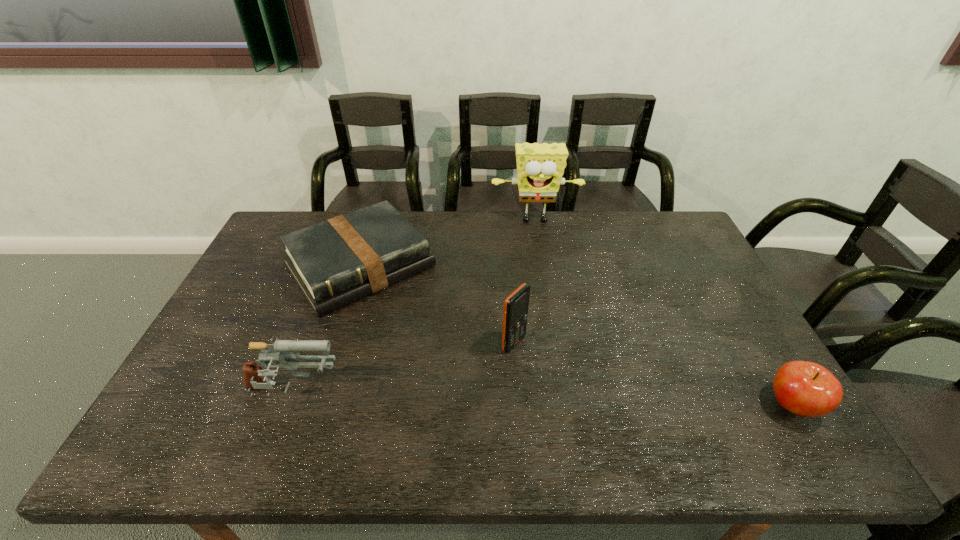
Image resolution: width=960 pixels, height=540 pixels. I want to click on vacant area that lies between the third tallest object and the hardback book, so (x=326, y=329).

Locate an element on the screen. The width and height of the screenshot is (960, 540). free space between the hardback book and the gun is located at coordinates (326, 329).

The image size is (960, 540). Identify the location of free space between the gun and the third nearest object. (403, 368).

Find the location of a particular element. The width and height of the screenshot is (960, 540). free area in between the shortest object and the cellular telephone is located at coordinates (437, 305).

The height and width of the screenshot is (540, 960). I want to click on free space between the shortest object and the rightmost object, so click(576, 335).

Locate an element on the screen. free space between the sponge and the apple is located at coordinates (x=663, y=313).

Where is `unoccupied area between the cellular telephone and the sponge`? This screenshot has width=960, height=540. unoccupied area between the cellular telephone and the sponge is located at coordinates (524, 282).

Locate an element on the screen. free point between the apple and the hardback book is located at coordinates (576, 335).

Identify the location of free spot between the gun and the sponge. click(x=414, y=307).

Locate an element on the screen. This screenshot has height=540, width=960. empty space that is in between the shortest object and the apple is located at coordinates (576, 335).